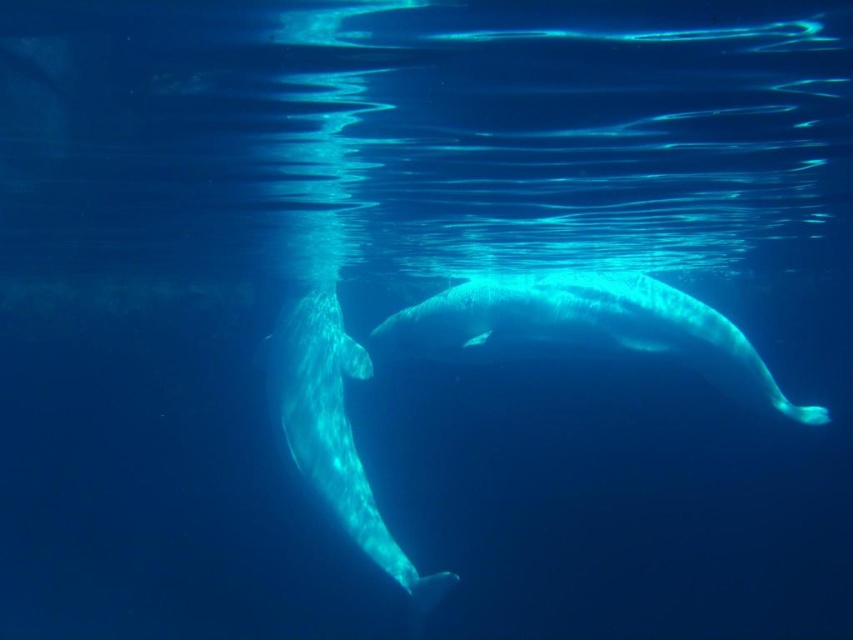
You are a marine biologist studying underwater creatures. You observe a translucent blue whale at center in the image. Can you determine its exact coordinates in the scene?

The translucent blue whale at center is located at point (585, 328).